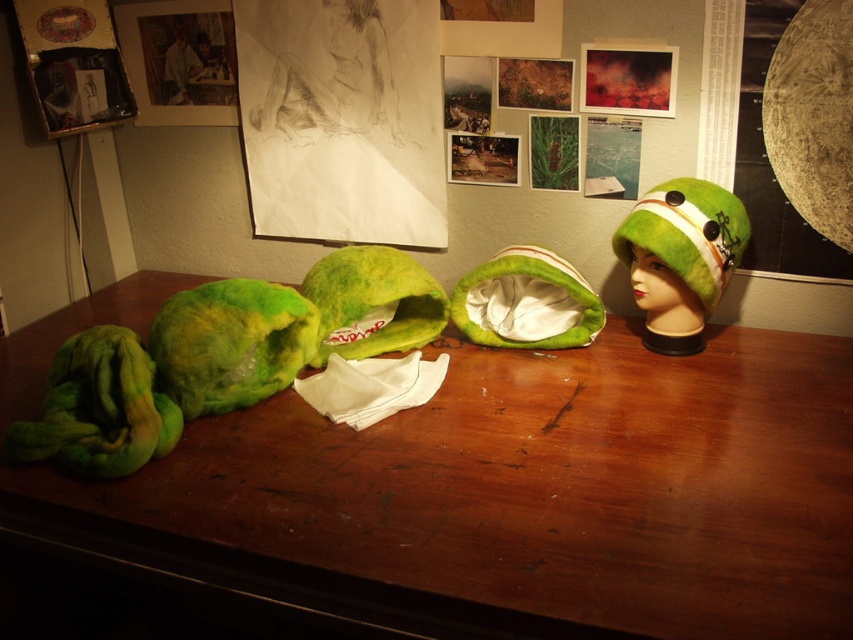
You are a customer looking to buy a hat for your child. You see the green felted hat at center and the green felt hat at right. Which one is taller?

The green felted hat at center is taller than the green felt hat at right.

You are looking at the workspace and need to place a small tool exactly halfway between point (473, 497) and point (654, 333) on the table. Which direction should you move from the closer point to reach the halfway point?

To place the tool halfway between point (473, 497) and point (654, 333), you should move from the closer point (473, 497) toward the direction of point (654, 333) by half the distance between them. Since point (473, 497) is closer to the viewer, moving towards the other point will reach the midpoint.